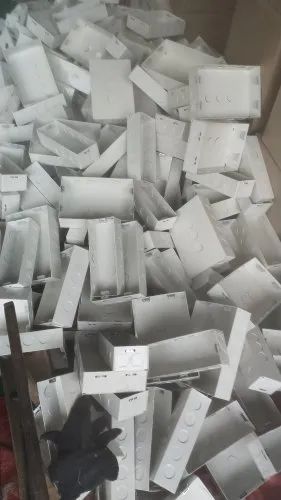
You are a GUI agent. You are given a task and a screenshot of the screen. Output one action in this format:
    pyautogui.click(x=<x>, y=<y>)
    Task: Click on the red mat
    
    Given the screenshot: What is the action you would take?
    pyautogui.click(x=9, y=468), pyautogui.click(x=277, y=485)